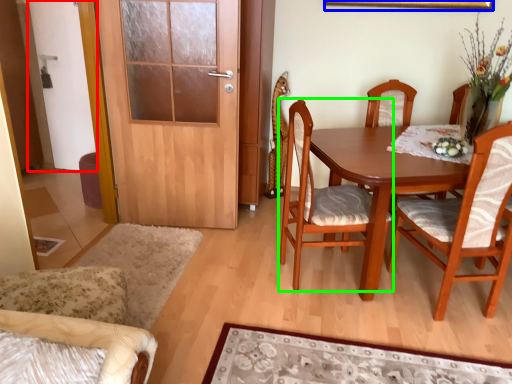
Question: Which object is the closest to the screen door (highlighted by a red box)? Choose among these: picture frame (highlighted by a blue box) or chair (highlighted by a green box).

Choices:
 (A) picture frame
 (B) chair

Answer: (B)